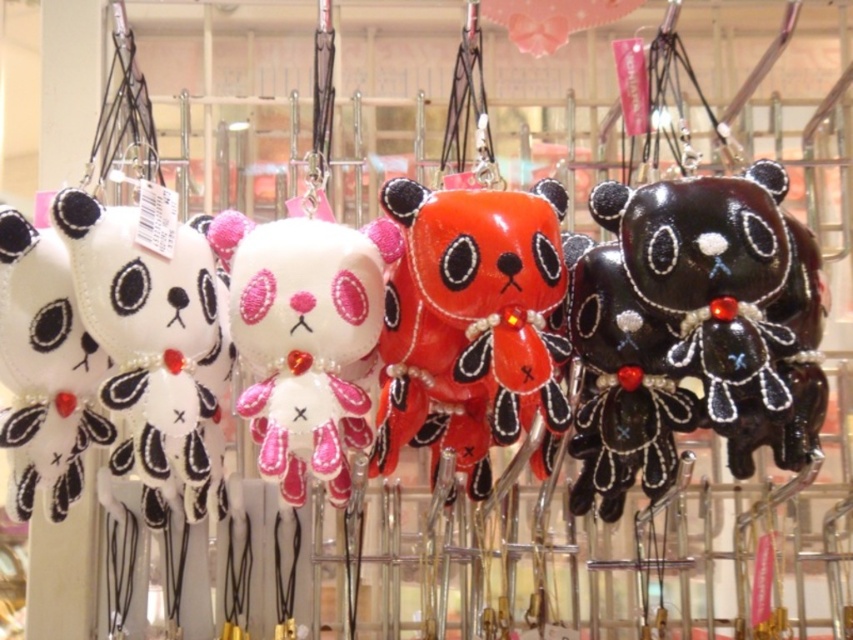
Question: Considering the real-world distances, which object is closest to the white felt plush at center?

Choices:
 (A) glossy black bear at right
 (B) white felt panda at left

Answer: (B)

Question: Does glossy black bear at right have a larger size compared to white felt plush at center?

Choices:
 (A) yes
 (B) no

Answer: (A)

Question: Does white felt plush at center appear on the left side of matte black plush bear at left?

Choices:
 (A) no
 (B) yes

Answer: (A)

Question: Among these points, which one is nearest to the camera?

Choices:
 (A) (117, 342)
 (B) (560, 358)
 (C) (288, 362)
 (D) (74, 442)

Answer: (A)

Question: Which object is the farthest from the glossy black bear at right?

Choices:
 (A) shiny orange plush bear at center
 (B) matte black plush bear at left
 (C) white felt panda at left

Answer: (B)

Question: Can you confirm if shiny orange plush bear at center is thinner than white felt panda at left?

Choices:
 (A) no
 (B) yes

Answer: (A)